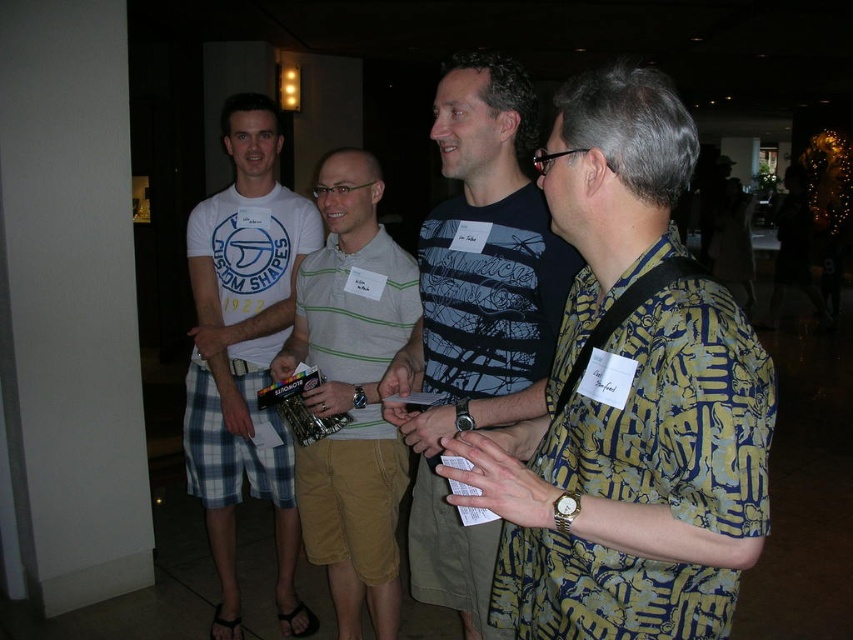
In the scene shown: Who is shorter, white t-shirt at left or striped cotton polo shirt at center?

With less height is striped cotton polo shirt at center.

Between white t-shirt at left and striped cotton polo shirt at center, which one is positioned higher?

Positioned higher is white t-shirt at left.

Is point (213, 320) positioned in front of point (387, 356)?

No, (213, 320) is further to viewer.

The width and height of the screenshot is (853, 640). Find the location of `white t-shirt at left`. white t-shirt at left is located at coordinates [244, 353].

Can you confirm if yellow printed shirt at center is positioned above dark blue striped shirt at center?

Yes, yellow printed shirt at center is above dark blue striped shirt at center.

Which is behind, point (680, 529) or point (460, 250)?

The point (460, 250) is more distant.

Who is more distant from viewer, (728, 365) or (381, 387)?

Point (381, 387)

You are a GUI agent. You are given a task and a screenshot of the screen. Output one action in this format:
    pyautogui.click(x=<x>, y=<y>)
    Task: Click on the yellow printed shirt at center
    The width and height of the screenshot is (853, 640).
    Given the screenshot: What is the action you would take?
    [628, 403]

What do you see at coordinates (476, 317) in the screenshot? Image resolution: width=853 pixels, height=640 pixels. I see `dark blue striped shirt at center` at bounding box center [476, 317].

Can you confirm if dark blue striped shirt at center is bigger than striped cotton polo shirt at center?

No.

Is point (480, 260) positioned before point (346, 456)?

That is True.

Find the location of a particular element. This screenshot has width=853, height=640. dark blue striped shirt at center is located at coordinates (476, 317).